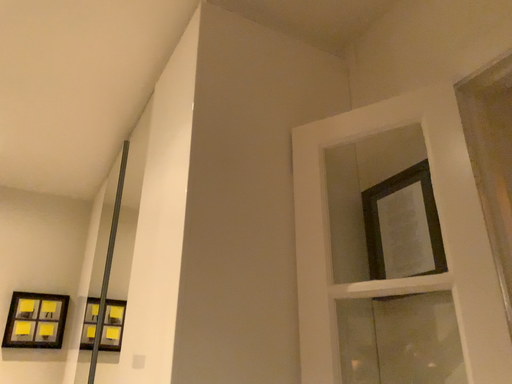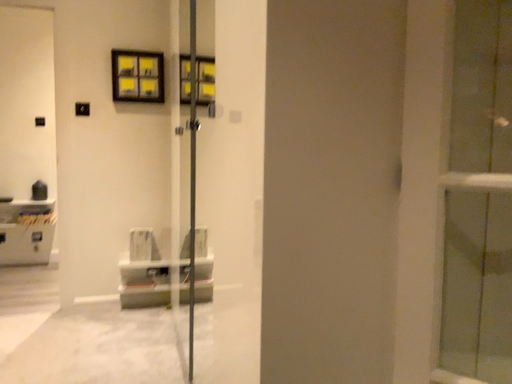
Question: How did the camera likely rotate when shooting the video?

Choices:
 (A) rotated left
 (B) rotated right

Answer: (A)